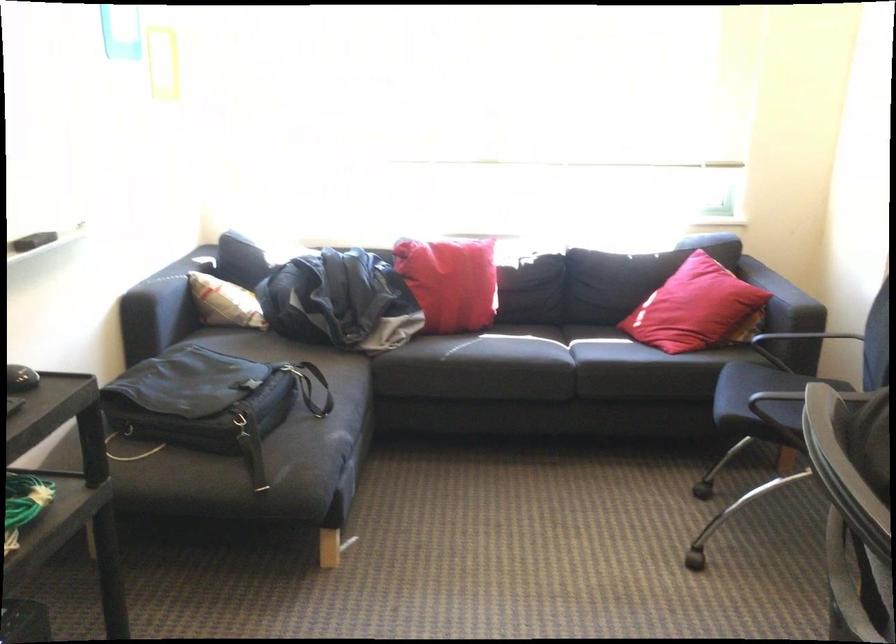
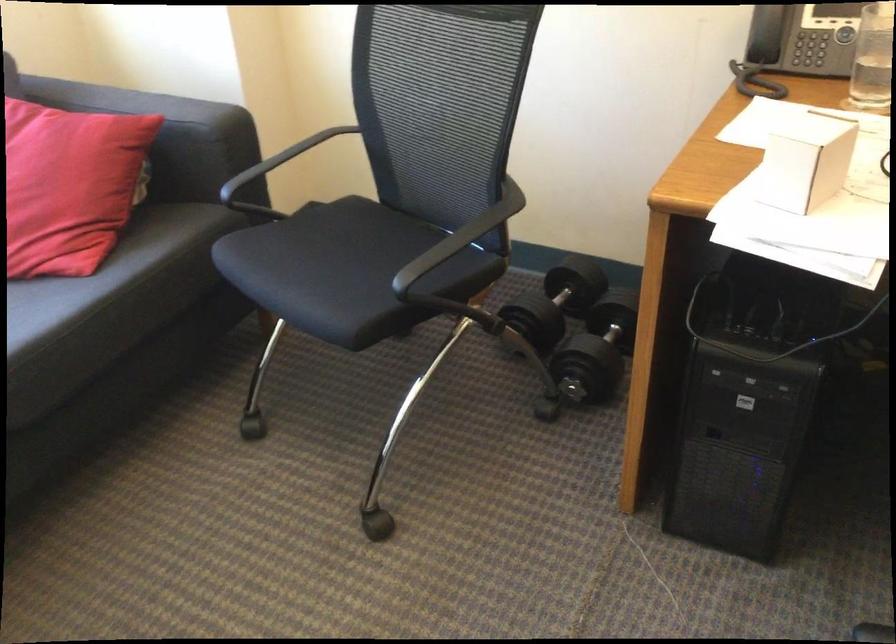
In the second image, find the point that corresponds to (731,348) in the first image.

(156, 230)